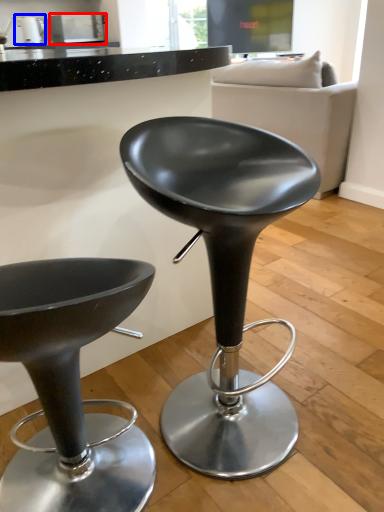
Question: Which object is closer to the camera taking this photo, appliance (highlighted by a red box) or appliance (highlighted by a blue box)?

Choices:
 (A) appliance
 (B) appliance

Answer: (B)